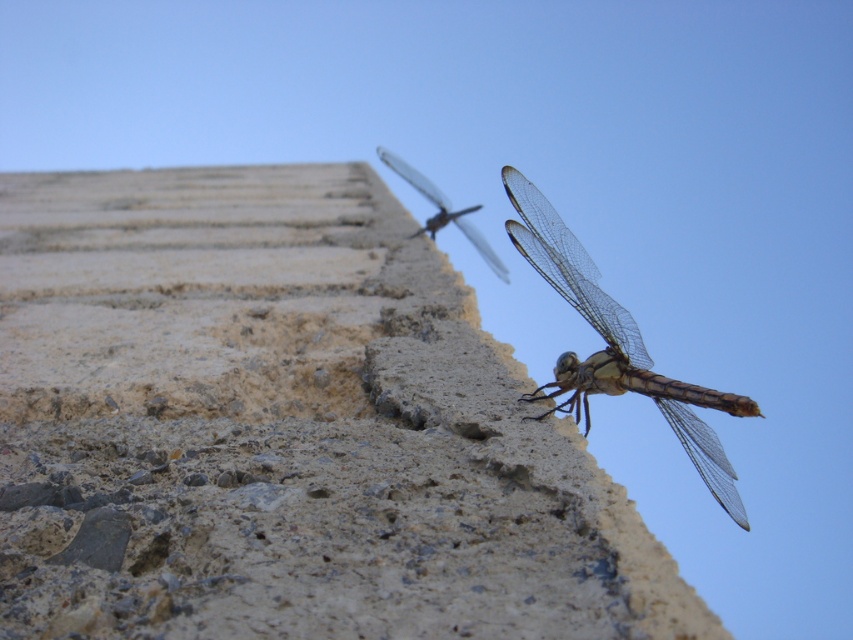
Does rough concrete wall at center appear on the left side of translucent winged insect at upper center?

Yes, rough concrete wall at center is to the left of translucent winged insect at upper center.

Can you confirm if rough concrete wall at center is shorter than translucent winged insect at upper center?

In fact, rough concrete wall at center may be taller than translucent winged insect at upper center.

Is point (276, 515) positioned in front of point (505, 276)?

Yes, point (276, 515) is in front of point (505, 276).

Find the location of `rough concrete wall at center`. rough concrete wall at center is located at coordinates (283, 428).

Which is behind, point (556, 433) or point (587, 381)?

Positioned behind is point (587, 381).

Can you confirm if rough concrete wall at center is smaller than translucent brown dragonfly at upper right?

Incorrect, rough concrete wall at center is not smaller in size than translucent brown dragonfly at upper right.

Does point (672, 624) lie in front of point (741, 400)?

Yes.

Locate an element on the screen. rough concrete wall at center is located at coordinates (283, 428).

Which is above, translucent brown dragonfly at upper right or translucent winged insect at upper center?

Positioned higher is translucent winged insect at upper center.

Is translucent brown dragonfly at upper right positioned before translucent winged insect at upper center?

That is True.

Is point (686, 433) more distant than point (483, 250)?

No, (686, 433) is in front of (483, 250).

Where is `translucent brown dragonfly at upper right`? translucent brown dragonfly at upper right is located at coordinates [616, 342].